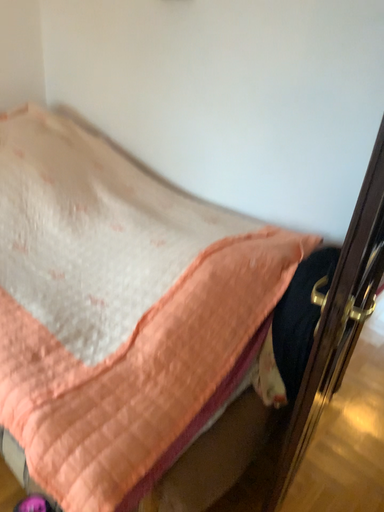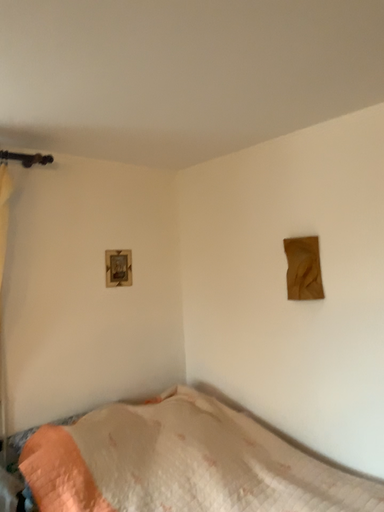
Question: How did the camera likely rotate when shooting the video?

Choices:
 (A) rotated downward
 (B) rotated upward

Answer: (B)